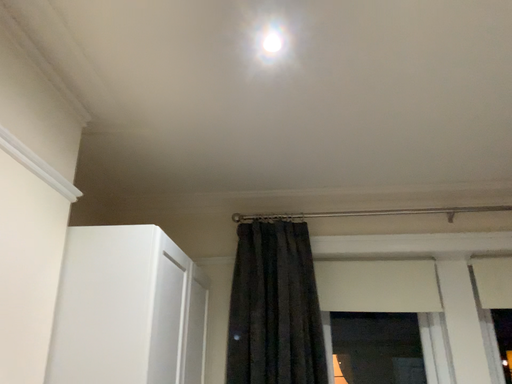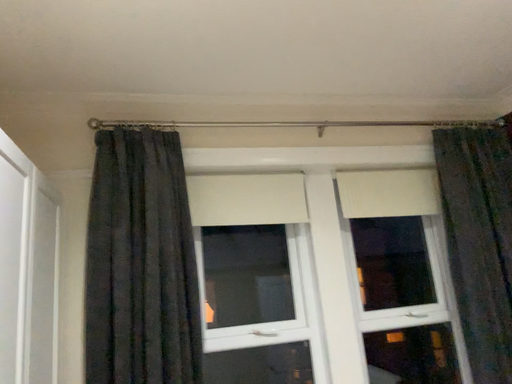
Question: Which way did the camera rotate in the video?

Choices:
 (A) rotated upward
 (B) rotated downward

Answer: (B)